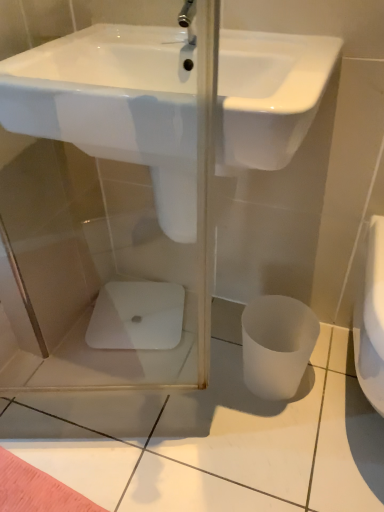
Locate an element on the screen. vacant space in front of white matte toilet bowl at lower right is located at coordinates (286, 435).